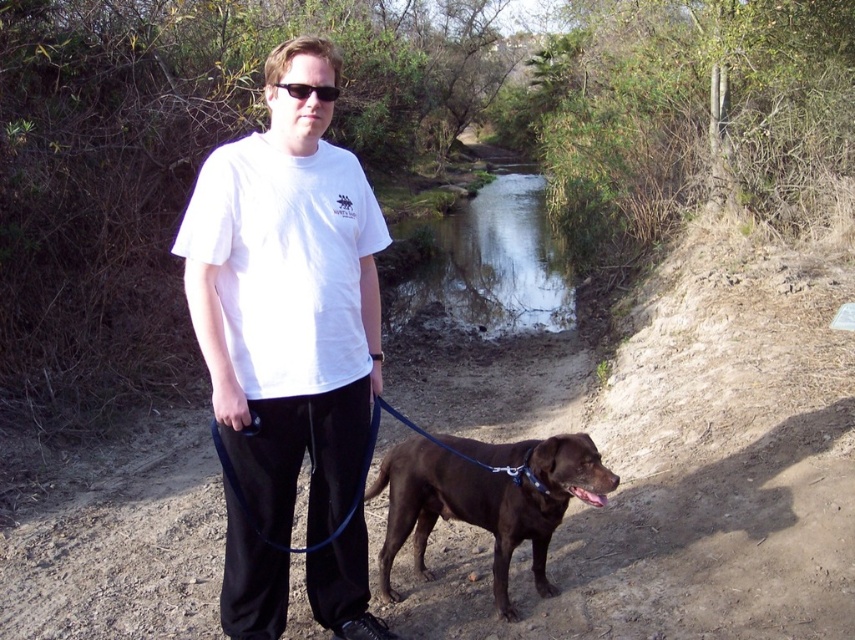
Question: Which object appears farthest from the camera in this image?

Choices:
 (A) white cotton t-shirt at center
 (B) shiny brown dog at center

Answer: (B)

Question: Is clear water at center bigger than shiny brown dog at center?

Choices:
 (A) yes
 (B) no

Answer: (A)

Question: Estimate the real-world distances between objects in this image. Which object is closer to the shiny brown dog at center?

Choices:
 (A) clear water at center
 (B) white cotton t-shirt at center

Answer: (B)

Question: Which object is closer to the camera taking this photo?

Choices:
 (A) white cotton t-shirt at center
 (B) shiny brown dog at center
 (C) black plastic sunglasses at center

Answer: (A)

Question: Does shiny brown dog at center appear on the left side of black plastic sunglasses at center?

Choices:
 (A) no
 (B) yes

Answer: (A)

Question: Is white cotton t-shirt at center further to camera compared to black plastic sunglasses at center?

Choices:
 (A) no
 (B) yes

Answer: (A)